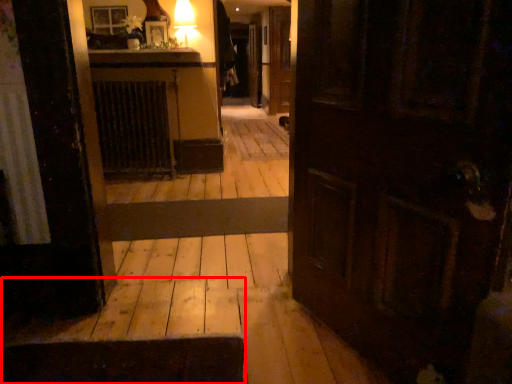
Question: Where is stairwell (annotated by the red box) located in relation to radiator in the image?

Choices:
 (A) right
 (B) left

Answer: (A)